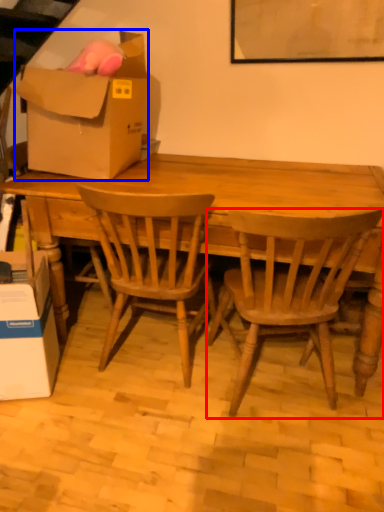
Question: Which of the following is the farthest to the observer, chair (highlighted by a red box) or box (highlighted by a blue box)?

Choices:
 (A) chair
 (B) box

Answer: (B)